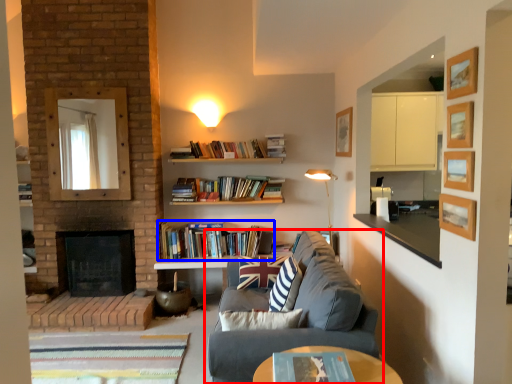
Question: Which of the following is the farthest to the observer, studio couch (highlighted by a red box) or book (highlighted by a blue box)?

Choices:
 (A) studio couch
 (B) book

Answer: (B)